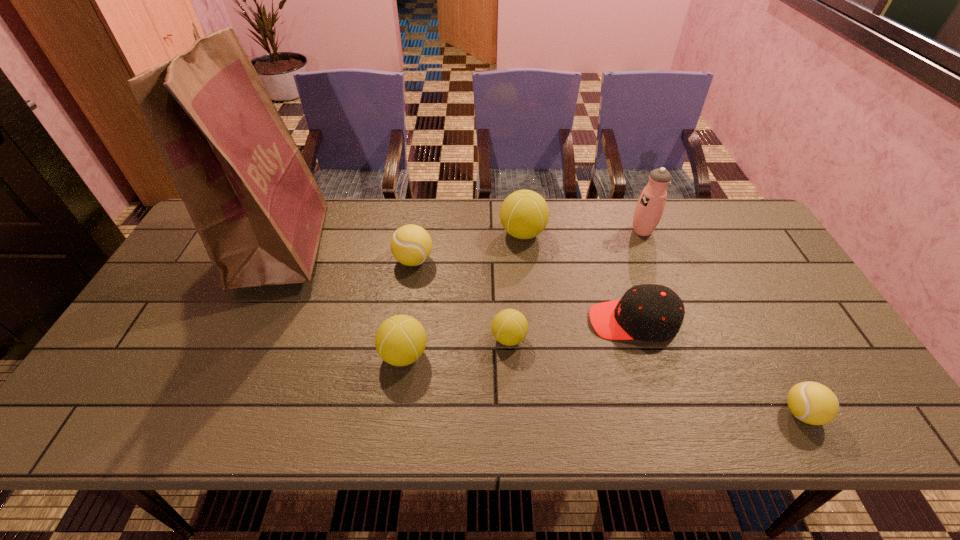
At what (x,y) coordinates should I click in order to perform the action: click on free space between the cap and the second tallest object. Please return your answer as a coordinate pair (x, y). The width and height of the screenshot is (960, 540). Looking at the image, I should click on (637, 276).

Identify the location of free space that is in between the farthest green tennis ball and the smallest green tennis ball. (516, 286).

Locate an element on the screen. The width and height of the screenshot is (960, 540). empty location between the second tallest object and the leftmost object is located at coordinates (463, 238).

The height and width of the screenshot is (540, 960). I want to click on free space that is in between the left yellow tennis ball and the farthest green tennis ball, so click(x=468, y=247).

Where is `object that is the fourth closest to the seventh shortest object`? Image resolution: width=960 pixels, height=540 pixels. object that is the fourth closest to the seventh shortest object is located at coordinates (813, 403).

Where is `object that is the fifth closest to the tallest object`? The height and width of the screenshot is (540, 960). object that is the fifth closest to the tallest object is located at coordinates (648, 312).

Find the location of a particular element. tennis ball that stands as the closest to the smallest green tennis ball is located at coordinates (400, 340).

Find the location of a particular element. tennis ball that is the closest to the smallest green tennis ball is located at coordinates (400, 340).

Image resolution: width=960 pixels, height=540 pixels. Identify the location of the second closest green tennis ball to the cap. (524, 214).

Find the location of a particular element. green tennis ball that is the nearest to the leftmost green tennis ball is located at coordinates (509, 327).